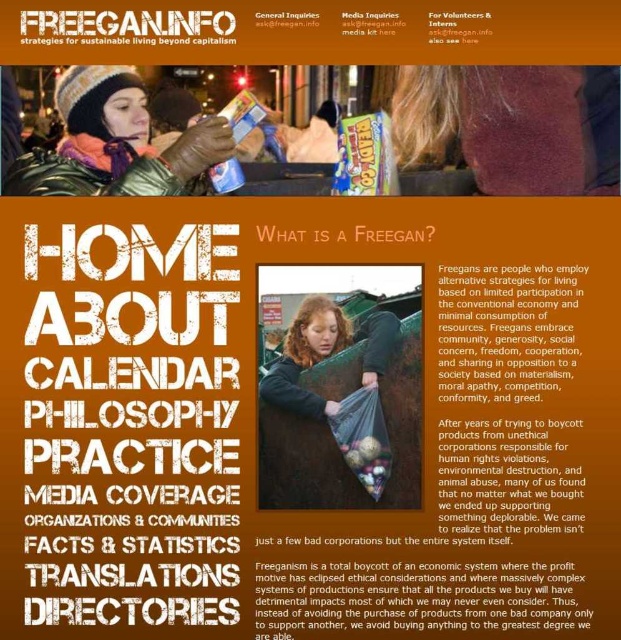
Question: Is white paper text at center thinner than white paper media kit at upper center?

Choices:
 (A) no
 (B) yes

Answer: (A)

Question: Is green leather jacket at upper left further to camera compared to white paper at upper center?

Choices:
 (A) no
 (B) yes

Answer: (B)

Question: Which point appears farthest from the camera in this image?

Choices:
 (A) (356, 13)
 (B) (478, 20)
 (C) (183, 381)
 (D) (291, 26)

Answer: (B)

Question: Considering the real-world distances, which object is farthest from the white paper text at center?

Choices:
 (A) white paper media kit at upper center
 (B) white paper at upper center
 (C) matte orange text at upper right
 (D) green leather jacket at upper left

Answer: (C)

Question: Which object is positioned farthest from the green leather jacket at upper left?

Choices:
 (A) white paper text at center
 (B) white paper media kit at upper center
 (C) matte orange text at upper right
 (D) white paper at upper center

Answer: (C)

Question: Is green leather jacket at upper left above white paper at upper center?

Choices:
 (A) no
 (B) yes

Answer: (A)